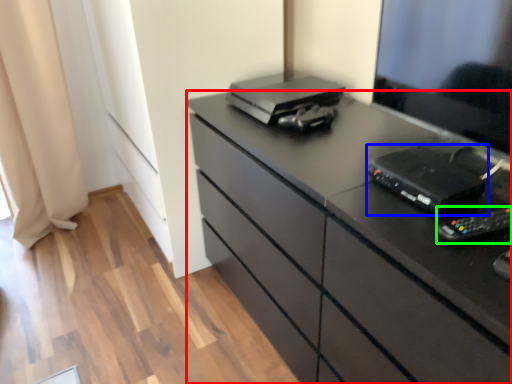
Question: Which is nearer to the chest of drawers (highlighted by a red box)? equipment (highlighted by a blue box) or equipment (highlighted by a green box).

Choices:
 (A) equipment
 (B) equipment

Answer: (A)